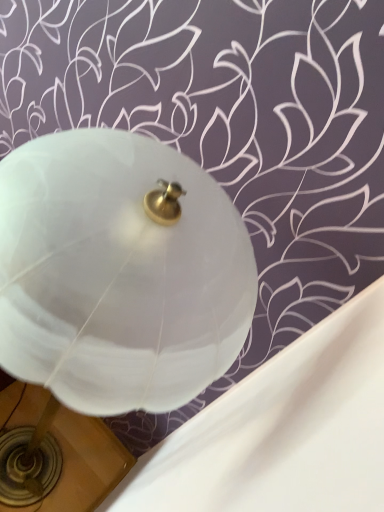
The width and height of the screenshot is (384, 512). In order to click on translucent glass lampshade at center in this screenshot , I will do click(119, 272).

This screenshot has width=384, height=512. What do you see at coordinates (119, 272) in the screenshot? I see `translucent glass lampshade at center` at bounding box center [119, 272].

I want to click on translucent glass lampshade at center, so click(x=119, y=272).